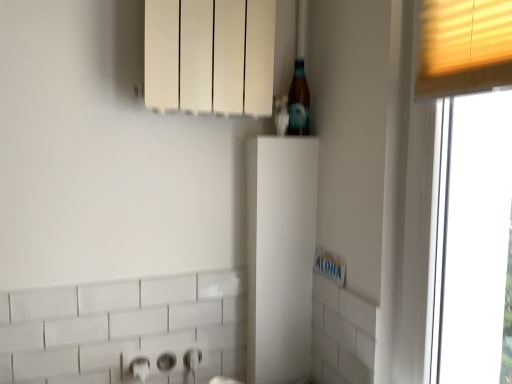
Question: Can white matte cabinet at center, positioned as the 1th cabinetry in bottom-to-top order, be found inside white matte radiator at upper center, marked as the 1th cabinetry in a top-to-bottom arrangement?

Choices:
 (A) no
 (B) yes

Answer: (A)

Question: Would you say white matte radiator at upper center, marked as the 1th cabinetry in a top-to-bottom arrangement, is a long distance from white matte cabinet at center, positioned as the 1th cabinetry in bottom-to-top order?

Choices:
 (A) yes
 (B) no

Answer: (B)

Question: Can you confirm if white matte radiator at upper center, placed as the second cabinetry when sorted from bottom to top, is bigger than white matte cabinet at center, the second cabinetry when ordered from top to bottom?

Choices:
 (A) no
 (B) yes

Answer: (B)

Question: Is white matte radiator at upper center, marked as the 1th cabinetry in a top-to-bottom arrangement, shorter than white matte cabinet at center, the second cabinetry when ordered from top to bottom?

Choices:
 (A) yes
 (B) no

Answer: (A)

Question: Is white matte radiator at upper center, placed as the second cabinetry when sorted from bottom to top, thinner than white matte cabinet at center, the second cabinetry when ordered from top to bottom?

Choices:
 (A) no
 (B) yes

Answer: (A)

Question: Would you say white matte radiator at upper center, marked as the 1th cabinetry in a top-to-bottom arrangement, is inside or outside white matte cabinet at center, positioned as the 1th cabinetry in bottom-to-top order?

Choices:
 (A) outside
 (B) inside

Answer: (A)

Question: Is white matte radiator at upper center, placed as the second cabinetry when sorted from bottom to top, bigger or smaller than white matte cabinet at center, the second cabinetry when ordered from top to bottom?

Choices:
 (A) big
 (B) small

Answer: (A)

Question: Looking at their shapes, would you say white matte radiator at upper center, placed as the second cabinetry when sorted from bottom to top, is wider or thinner than white matte cabinet at center, positioned as the 1th cabinetry in bottom-to-top order?

Choices:
 (A) thin
 (B) wide

Answer: (B)

Question: In the image, is white matte radiator at upper center, marked as the 1th cabinetry in a top-to-bottom arrangement, positioned in front of or behind white matte cabinet at center, the second cabinetry when ordered from top to bottom?

Choices:
 (A) front
 (B) behind

Answer: (A)

Question: In the image, is translucent glass bottle at upper right on the left side or the right side of white matte radiator at upper center, marked as the 1th cabinetry in a top-to-bottom arrangement?

Choices:
 (A) right
 (B) left

Answer: (A)

Question: From the image's perspective, relative to white matte radiator at upper center, placed as the second cabinetry when sorted from bottom to top, is translucent glass bottle at upper right above or below?

Choices:
 (A) below
 (B) above

Answer: (A)

Question: Does point (306, 99) appear closer or farther from the camera than point (148, 66)?

Choices:
 (A) closer
 (B) farther

Answer: (B)

Question: Is translucent glass bottle at upper right wider or thinner than white matte radiator at upper center, marked as the 1th cabinetry in a top-to-bottom arrangement?

Choices:
 (A) thin
 (B) wide

Answer: (A)

Question: Is white matte radiator at upper center, marked as the 1th cabinetry in a top-to-bottom arrangement, spatially inside translucent glass bottle at upper right, or outside of it?

Choices:
 (A) outside
 (B) inside

Answer: (A)

Question: From a real-world perspective, is white matte radiator at upper center, placed as the second cabinetry when sorted from bottom to top, physically located above or below translucent glass bottle at upper right?

Choices:
 (A) below
 (B) above

Answer: (B)